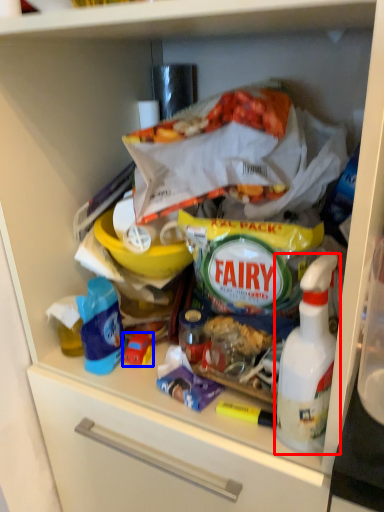
Question: Which object is closer to the camera taking this photo, bottle (highlighted by a red box) or toy (highlighted by a blue box)?

Choices:
 (A) bottle
 (B) toy

Answer: (A)